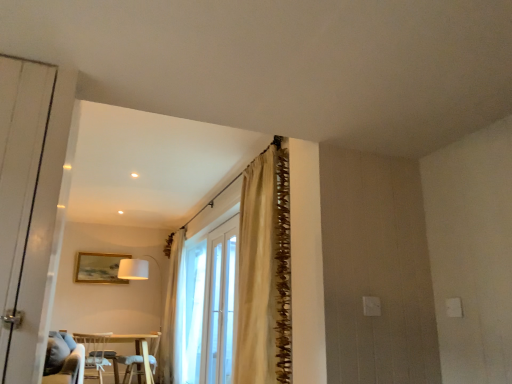
Question: Considering the relative sizes of white fabric chair at lower left and clear glass door at center in the image provided, is white fabric chair at lower left smaller than clear glass door at center?

Choices:
 (A) no
 (B) yes

Answer: (A)

Question: Can you confirm if white fabric chair at lower left is shorter than clear glass door at center?

Choices:
 (A) no
 (B) yes

Answer: (B)

Question: Is the position of white fabric chair at lower left more distant than that of clear glass door at center?

Choices:
 (A) no
 (B) yes

Answer: (B)

Question: Is white fabric chair at lower left positioned in front of clear glass door at center?

Choices:
 (A) no
 (B) yes

Answer: (A)

Question: Considering the relative positions of white fabric chair at lower left and clear glass door at center in the image provided, is white fabric chair at lower left to the right of clear glass door at center from the viewer's perspective?

Choices:
 (A) no
 (B) yes

Answer: (A)

Question: Is white fabric chair at lower left beside clear glass door at center?

Choices:
 (A) yes
 (B) no

Answer: (B)

Question: Is white wooden door at left next to white sheer curtain at center, which is the first curtain from left to right, and touching it?

Choices:
 (A) no
 (B) yes

Answer: (A)

Question: Can you confirm if white wooden door at left is bigger than white sheer curtain at center, which is the first curtain from left to right?

Choices:
 (A) yes
 (B) no

Answer: (B)

Question: Can you confirm if white wooden door at left is taller than white sheer curtain at center, the 2th curtain from the front?

Choices:
 (A) yes
 (B) no

Answer: (B)

Question: Is white wooden door at left behind white sheer curtain at center, which is the first curtain from left to right?

Choices:
 (A) no
 (B) yes

Answer: (A)

Question: Can you confirm if white wooden door at left is positioned to the right of white sheer curtain at center, the 2th curtain from the front?

Choices:
 (A) no
 (B) yes

Answer: (B)

Question: Is white wooden door at left at the left side of white sheer curtain at center, the 2th curtain when ordered from right to left?

Choices:
 (A) no
 (B) yes

Answer: (A)

Question: Is the position of gold metallic picture frame at upper center more distant than that of white glass bay window at center?

Choices:
 (A) no
 (B) yes

Answer: (B)